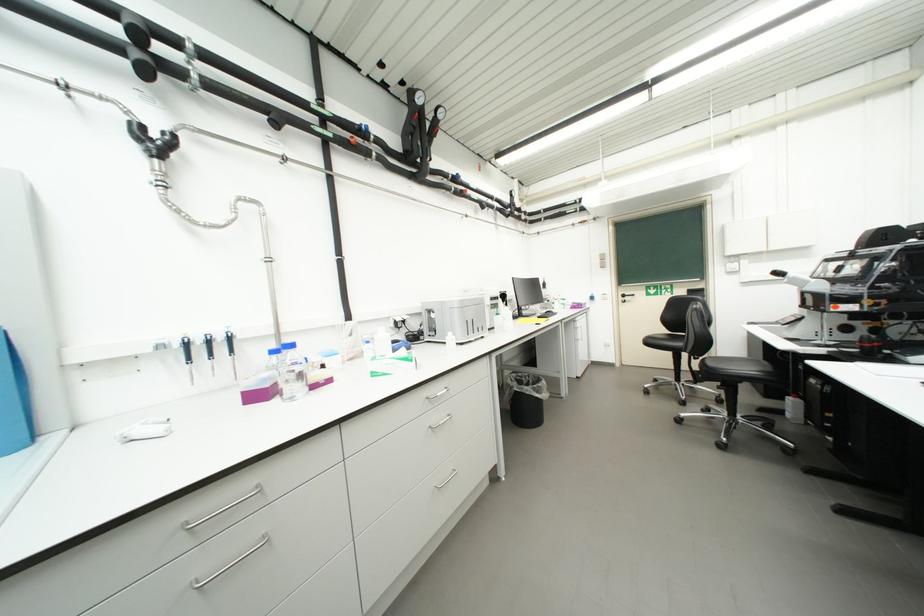
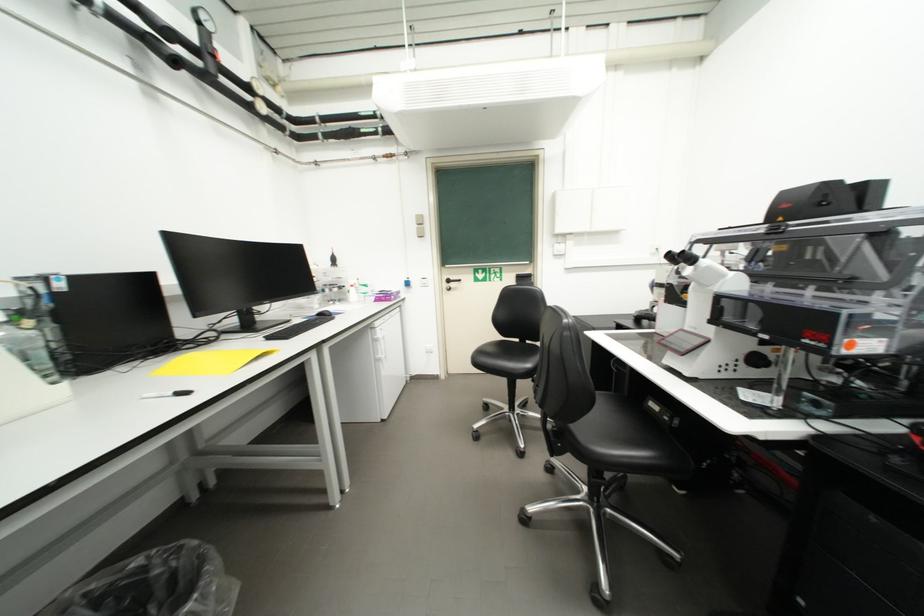
The point at (x=546, y=318) is marked in the first image. Where is the corresponding point in the second image?

(276, 339)